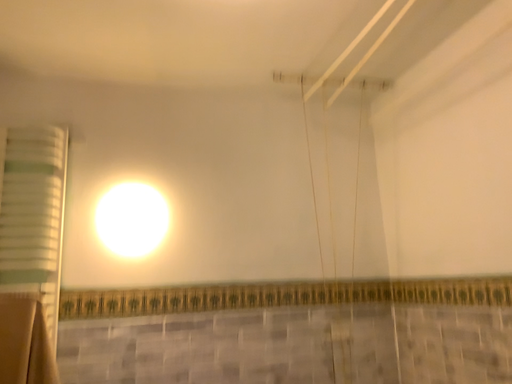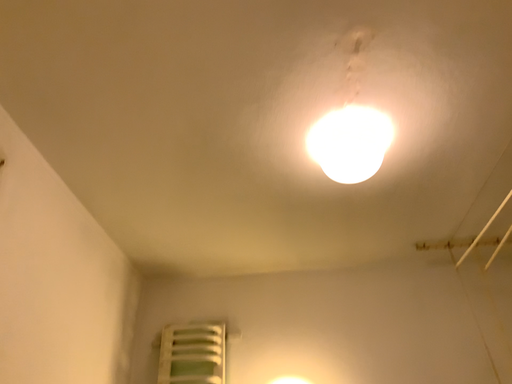
Question: How did the camera likely rotate when shooting the video?

Choices:
 (A) rotated right
 (B) rotated left

Answer: (B)